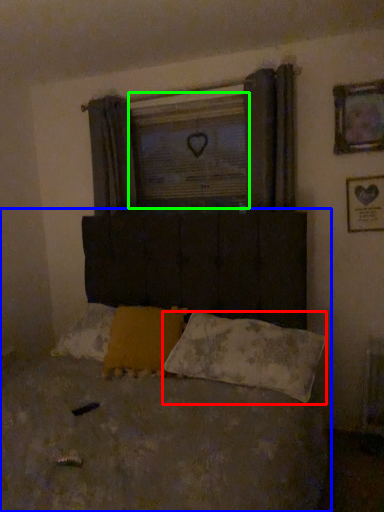
Question: Based on their relative distances, which object is nearer to pillow (highlighted by a red box)? Choose from bed (highlighted by a blue box) and window screen (highlighted by a green box).

Choices:
 (A) bed
 (B) window screen

Answer: (A)